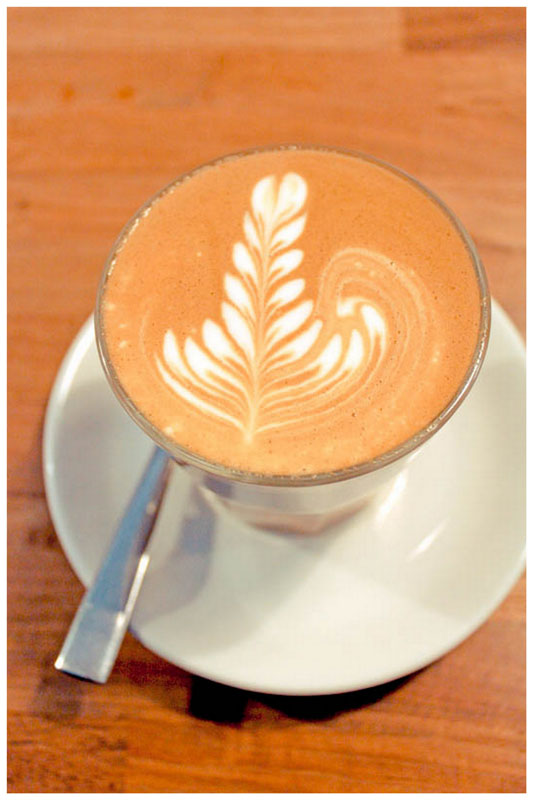
This screenshot has width=533, height=800. What are the coordinates of `wooden table` in the screenshot? It's located at (324, 62).